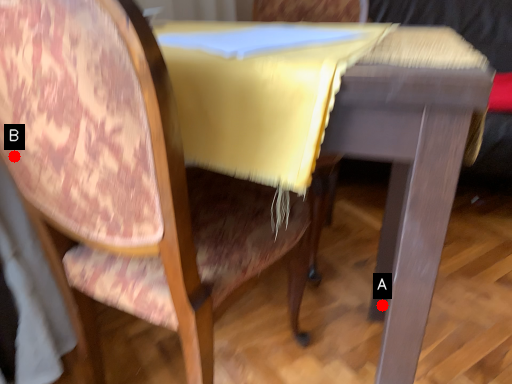
Question: Two points are circled on the image, labeled by A and B beside each circle. Which point is closer to the camera?

Choices:
 (A) A is closer
 (B) B is closer

Answer: (B)